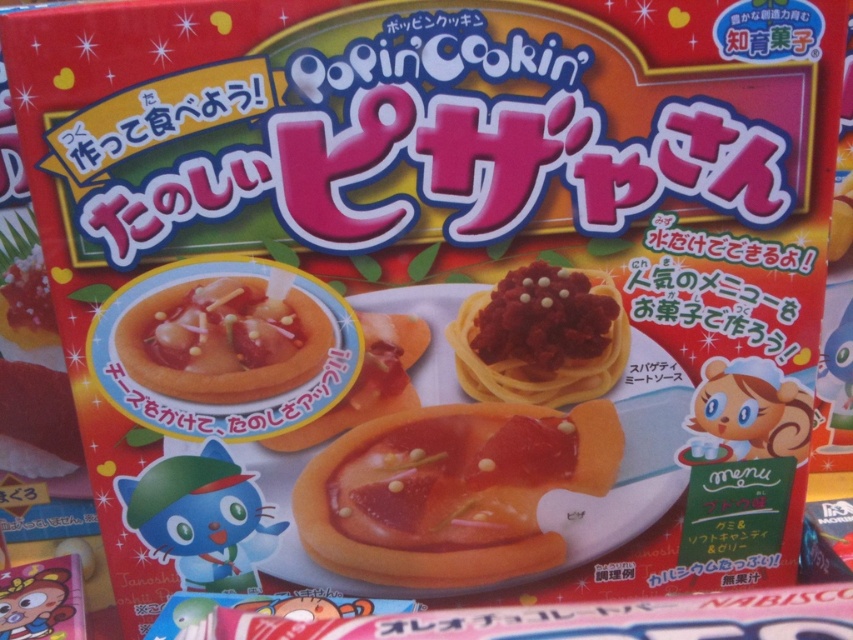
You are looking at the Popin Cookin pizza kit box. There is an orange soft candy at center and a matte red pasta at center. Which object is closer to you?

The orange soft candy at center is closer to you because it is further to the viewer than the matte red pasta at center.